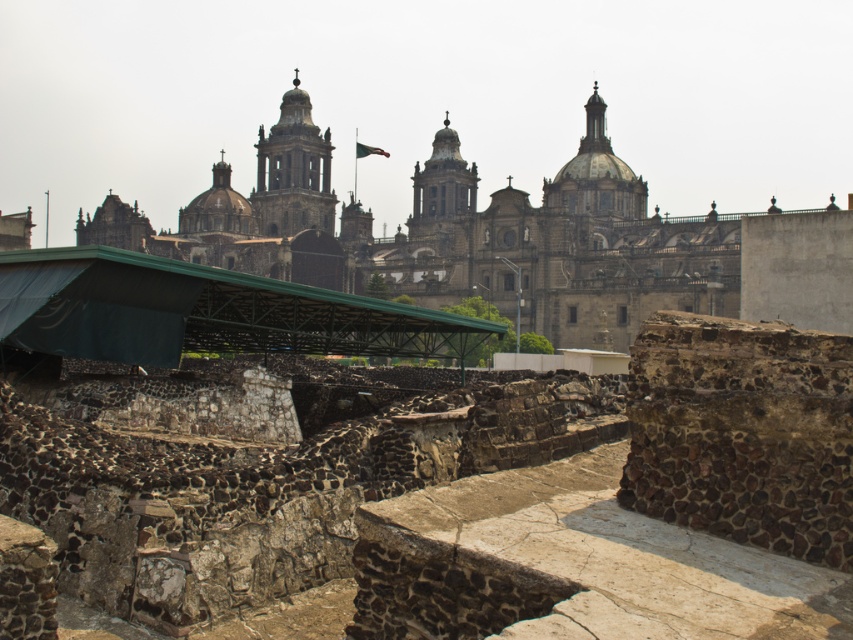
Consider the image. Which is above, brown stone ruins at center or smooth stone tower at center?

smooth stone tower at center

Is brown stone ruins at center below smooth stone tower at center?

Yes, brown stone ruins at center is below smooth stone tower at center.

Locate an element on the screen. The width and height of the screenshot is (853, 640). brown stone ruins at center is located at coordinates (508, 240).